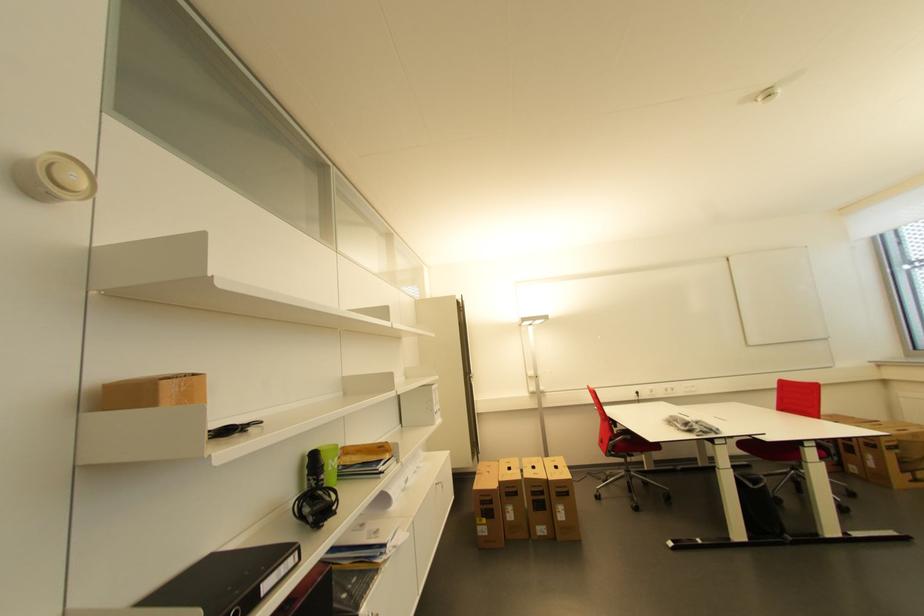
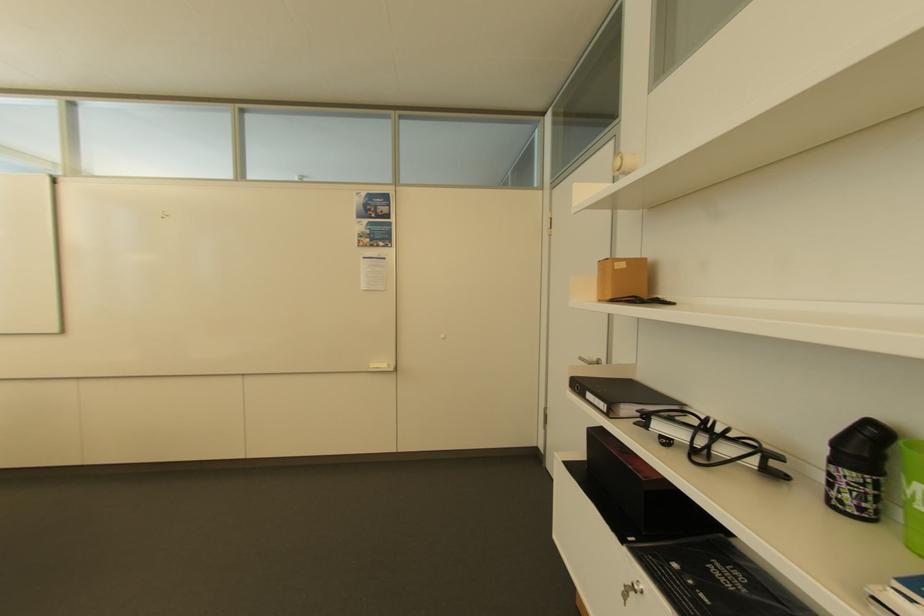
The point at (268, 586) is marked in the first image. Where is the corresponding point in the second image?

(592, 392)